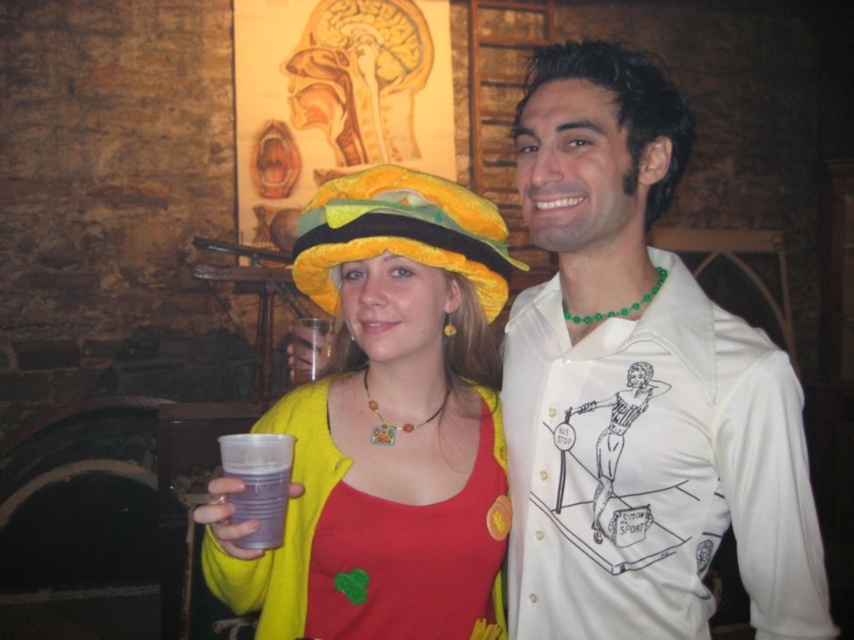
How far apart are white glossy shirt at center and translucent plastic cup at lower center?

19.54 inches

Does white glossy shirt at center appear over translucent plastic cup at lower center?

Correct, white glossy shirt at center is located above translucent plastic cup at lower center.

Identify the location of white glossy shirt at center. (638, 387).

The width and height of the screenshot is (854, 640). Find the location of `white glossy shirt at center`. white glossy shirt at center is located at coordinates (638, 387).

Does white glossy shirt at center appear on the right side of yellow fabric hat at center?

Correct, you'll find white glossy shirt at center to the right of yellow fabric hat at center.

Can you confirm if white glossy shirt at center is positioned below yellow fabric hat at center?

Actually, white glossy shirt at center is above yellow fabric hat at center.

Find the location of `white glossy shirt at center`. white glossy shirt at center is located at coordinates (638, 387).

The width and height of the screenshot is (854, 640). What are the coordinates of `white glossy shirt at center` in the screenshot? It's located at (638, 387).

Looking at this image, is yellow fabric hat at center below translucent plastic cup at lower center?

Actually, yellow fabric hat at center is above translucent plastic cup at lower center.

Identify the location of yellow fabric hat at center. This screenshot has width=854, height=640. (385, 426).

Which is behind, point (326, 536) or point (272, 504)?

Point (326, 536)

The image size is (854, 640). Identify the location of yellow fabric hat at center. (385, 426).